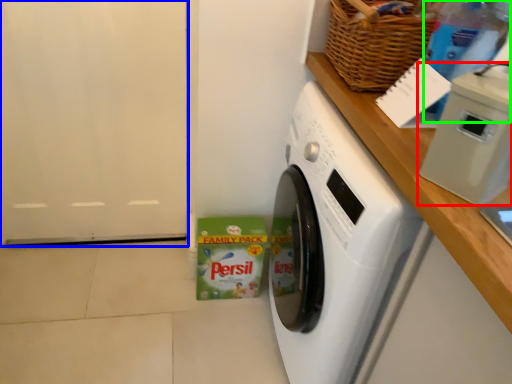
Question: Based on their relative distances, which object is nearer to appliance (highlighted by a red box)? Choose from door (highlighted by a blue box) and bottle (highlighted by a green box).

Choices:
 (A) door
 (B) bottle

Answer: (B)